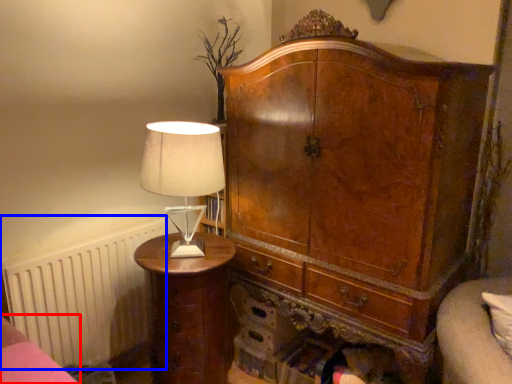
Question: Which point is further to the camera, bed frame (highlighted by a red box) or radiator (highlighted by a blue box)?

Choices:
 (A) bed frame
 (B) radiator

Answer: (B)